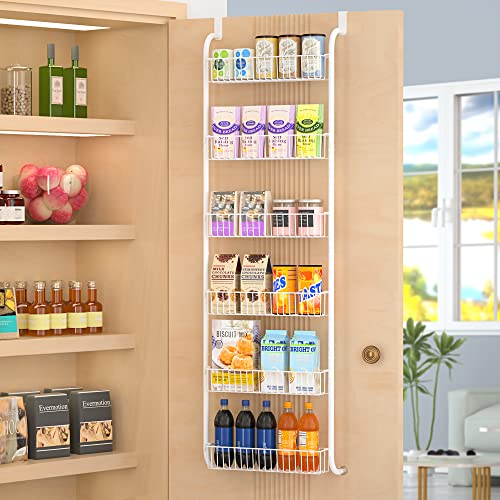
This screenshot has width=500, height=500. In order to click on shelf in this screenshot , I will do `click(294, 72)`, `click(266, 129)`, `click(280, 200)`, `click(275, 283)`, `click(279, 362)`, `click(261, 458)`.